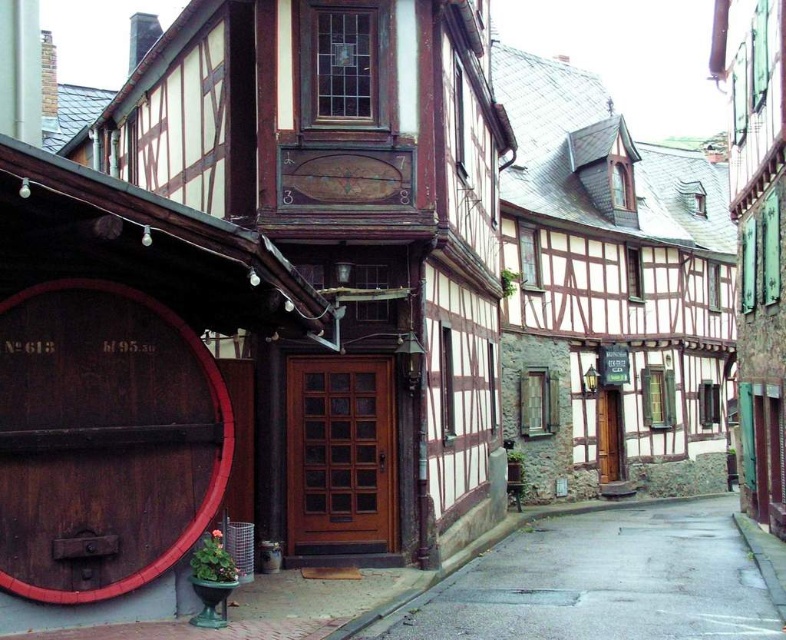
Between dark brown wooden barrel at lower left and gray concrete alley at center, which one is positioned lower?

gray concrete alley at center

Looking at this image, can you confirm if dark brown wooden barrel at lower left is taller than gray concrete alley at center?

Indeed, dark brown wooden barrel at lower left has a greater height compared to gray concrete alley at center.

Where is `dark brown wooden barrel at lower left`? The width and height of the screenshot is (786, 640). dark brown wooden barrel at lower left is located at coordinates (103, 440).